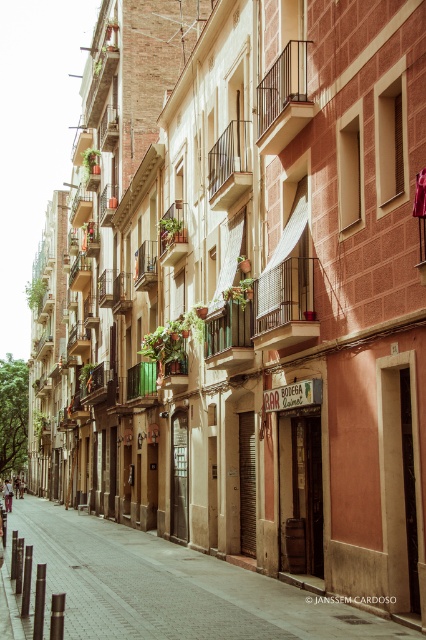
Can you confirm if metallic black balcony at upper center is wider than metallic silver balcony at center?

In fact, metallic black balcony at upper center might be narrower than metallic silver balcony at center.

Is metallic black balcony at upper center to the left of metallic silver balcony at center from the viewer's perspective?

In fact, metallic black balcony at upper center is to the right of metallic silver balcony at center.

What do you see at coordinates (282, 99) in the screenshot?
I see `metallic black balcony at upper center` at bounding box center [282, 99].

You are a GUI agent. You are given a task and a screenshot of the screen. Output one action in this format:
    pyautogui.click(x=<x>, y=<y>)
    Task: Click on the metallic black balcony at upper center
    The width and height of the screenshot is (426, 640).
    Given the screenshot: What is the action you would take?
    pyautogui.click(x=282, y=99)

Looking at this image, does wooden balcony at center appear on the left side of green wooden balcony at center?

No, wooden balcony at center is not to the left of green wooden balcony at center.

Based on the photo, is wooden balcony at center positioned in front of green wooden balcony at center?

That is True.

The height and width of the screenshot is (640, 426). Find the location of `wooden balcony at center`. wooden balcony at center is located at coordinates (229, 337).

Image resolution: width=426 pixels, height=640 pixels. I want to click on wooden balcony at center, so click(229, 337).

Is metallic mesh balcony at center taller than wooden balcony at center?

Yes, metallic mesh balcony at center is taller than wooden balcony at center.

Describe the element at coordinates (284, 305) in the screenshot. I see `metallic mesh balcony at center` at that location.

Image resolution: width=426 pixels, height=640 pixels. What are the coordinates of `metallic mesh balcony at center` in the screenshot? It's located at (284, 305).